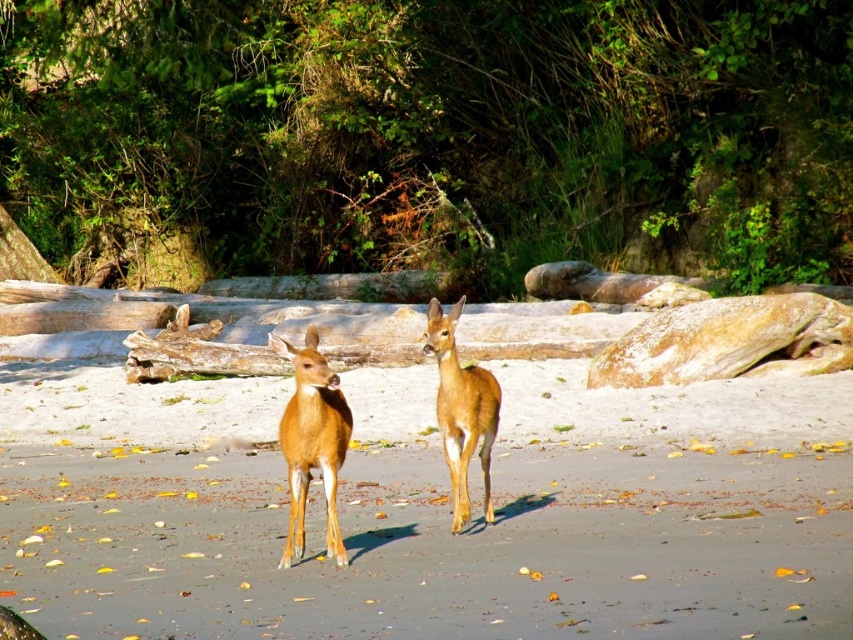
You are standing at the point with coordinates point (312,442). Looking around, you see a shiny brown deer at center. What object are you currently standing on?

The point (312,442) is on the shiny brown deer at center, so you are standing on the shiny brown deer at center.

You are standing at the origin point in the image and want to walk towards the point labeled as point (287, 536). Which direction should you move first to reach the point labeled point (177, 513)?

The question seems to have an inconsistency because according to the provided description, point (177, 513) is behind point (287, 536). Therefore, if you are moving towards point (287, 536), you would not encounter point (177, 513) along that path since it is located behind the target point.